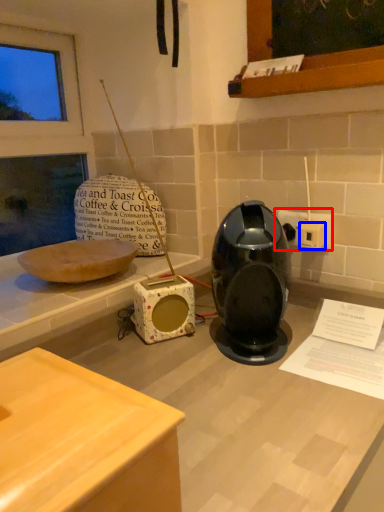
Question: Which point is further to the camera, electric outlet (highlighted by a red box) or electric outlet (highlighted by a blue box)?

Choices:
 (A) electric outlet
 (B) electric outlet

Answer: (A)